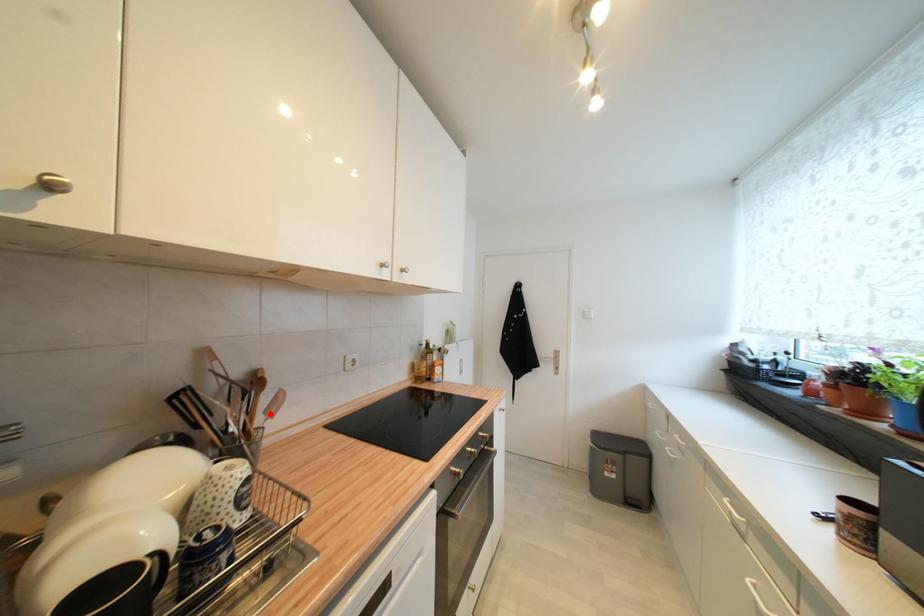
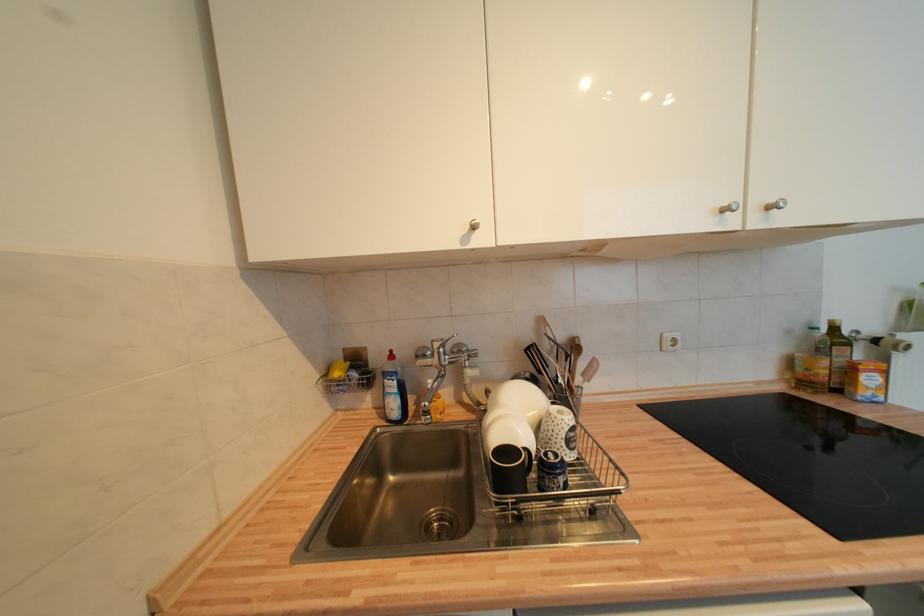
Locate, in the second image, the point that corresponds to the highlighted location in the first image.

(588, 377)